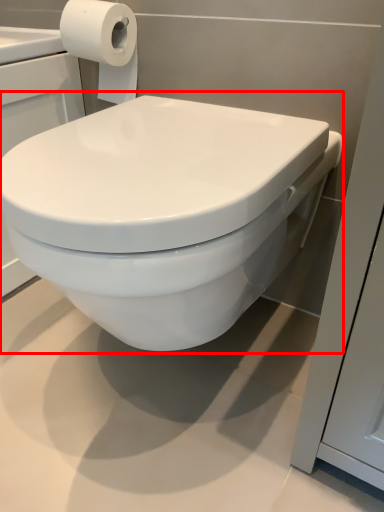
Question: Considering the relative positions of toilet (annotated by the red box) and toilet paper in the image provided, where is toilet (annotated by the red box) located with respect to the staircase?

Choices:
 (A) right
 (B) left

Answer: (A)